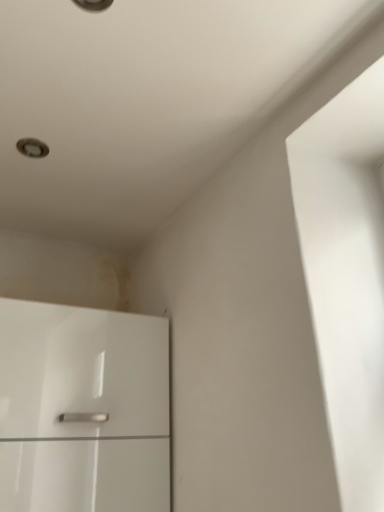
Question: Is matte silver light fixture at upper left facing towards glossy white cabinet at lower left?

Choices:
 (A) no
 (B) yes

Answer: (A)

Question: Is matte silver light fixture at upper left smaller than glossy white cabinet at lower left?

Choices:
 (A) yes
 (B) no

Answer: (A)

Question: Is matte silver light fixture at upper left shorter than glossy white cabinet at lower left?

Choices:
 (A) yes
 (B) no

Answer: (A)

Question: Is matte silver light fixture at upper left at the right side of glossy white cabinet at lower left?

Choices:
 (A) no
 (B) yes

Answer: (A)

Question: Considering the relative positions of matte silver light fixture at upper left and glossy white cabinet at lower left in the image provided, is matte silver light fixture at upper left behind glossy white cabinet at lower left?

Choices:
 (A) no
 (B) yes

Answer: (B)

Question: From a real-world perspective, is matte silver light fixture at upper left positioned over glossy white cabinet at lower left based on gravity?

Choices:
 (A) yes
 (B) no

Answer: (A)

Question: From the image's perspective, would you say glossy white cabinet at lower left is shown under matte silver light fixture at upper left?

Choices:
 (A) yes
 (B) no

Answer: (A)

Question: Is there a large distance between glossy white cabinet at lower left and matte silver light fixture at upper left?

Choices:
 (A) no
 (B) yes

Answer: (A)

Question: Considering the relative sizes of glossy white cabinet at lower left and matte silver light fixture at upper left in the image provided, is glossy white cabinet at lower left thinner than matte silver light fixture at upper left?

Choices:
 (A) yes
 (B) no

Answer: (B)

Question: Considering the relative positions of glossy white cabinet at lower left and matte silver light fixture at upper left in the image provided, is glossy white cabinet at lower left behind matte silver light fixture at upper left?

Choices:
 (A) yes
 (B) no

Answer: (B)

Question: From the image's perspective, is glossy white cabinet at lower left on top of matte silver light fixture at upper left?

Choices:
 (A) no
 (B) yes

Answer: (A)

Question: Is glossy white cabinet at lower left wider than matte silver light fixture at upper left?

Choices:
 (A) no
 (B) yes

Answer: (B)

Question: Is matte silver light fixture at upper left inside or outside of glossy white cabinet at lower left?

Choices:
 (A) inside
 (B) outside

Answer: (B)